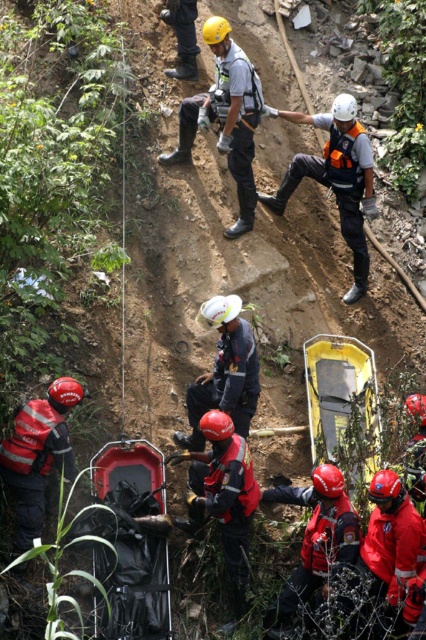
Can you confirm if black plastic stretcher at center is positioned to the left of red matte helmet at lower left?

In fact, black plastic stretcher at center is to the right of red matte helmet at lower left.

From the picture: Is black plastic stretcher at center positioned before red matte helmet at lower left?

Yes, black plastic stretcher at center is in front of red matte helmet at lower left.

What do you see at coordinates (132, 541) in the screenshot?
I see `black plastic stretcher at center` at bounding box center [132, 541].

Identify the location of black plastic stretcher at center. The width and height of the screenshot is (426, 640). (132, 541).

Which is more to the right, white hard hat at center or white matte helmet at center?

Positioned to the right is white matte helmet at center.

Looking at this image, between white hard hat at center and white matte helmet at center, which one has more height?

With more height is white hard hat at center.

In the scene shown: Who is more distant from viewer, (227, 236) or (236, 394)?

Positioned behind is point (227, 236).

Locate an element on the screen. white hard hat at center is located at coordinates (226, 116).

Consider the image. Between black plastic stretcher at center and white hard hat at upper center, which one has more height?

white hard hat at upper center

Which is behind, point (137, 500) or point (368, 182)?

The point (368, 182) is more distant.

Find the location of a particular element. The width and height of the screenshot is (426, 640). black plastic stretcher at center is located at coordinates (132, 541).